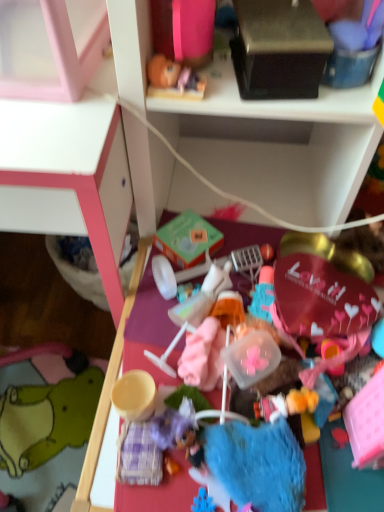
The image size is (384, 512). What do you see at coordinates (48, 416) in the screenshot? I see `green felt plush at lower left` at bounding box center [48, 416].

What do you see at coordinates (279, 49) in the screenshot?
I see `black matte box at upper center` at bounding box center [279, 49].

Where is `plastic toy at center`? The height and width of the screenshot is (512, 384). plastic toy at center is located at coordinates (128, 358).

From the image's perspective, is green felt plush at lower left located above or below black matte box at upper center?

Clearly, from the image's perspective, green felt plush at lower left is below black matte box at upper center.

Which of these two, green felt plush at lower left or black matte box at upper center, is bigger?

Bigger between the two is green felt plush at lower left.

Is green felt plush at lower left not close to black matte box at upper center?

No, green felt plush at lower left is not far away from black matte box at upper center.

I want to click on box that is on the right side of green felt plush at lower left, so click(279, 49).

Is white plastic shelf at upper center not within green felt plush at lower left?

Yes.

Based on the photo, is white plastic shelf at upper center taller than green felt plush at lower left?

Indeed, white plastic shelf at upper center has a greater height compared to green felt plush at lower left.

Are white plastic shelf at upper center and green felt plush at lower left located far from each other?

white plastic shelf at upper center is near green felt plush at lower left, not far away.

Based on the photo, from a real-world perspective, is white plastic shelf at upper center beneath green felt plush at lower left?

No, from a real-world perspective, white plastic shelf at upper center is not beneath green felt plush at lower left.

Does plastic toy at center have a larger size compared to white plastic shelf at upper center?

Actually, plastic toy at center might be smaller than white plastic shelf at upper center.

Is plastic toy at center far from white plastic shelf at upper center?

No, plastic toy at center is in close proximity to white plastic shelf at upper center.

Does plastic toy at center have a lesser width compared to white plastic shelf at upper center?

In fact, plastic toy at center might be wider than white plastic shelf at upper center.

Who is more distant, plastic toy at center or white plastic shelf at upper center?

Positioned behind is plastic toy at center.

Are plastic toy at center and black matte box at upper center far apart?

That's not correct — plastic toy at center is a little close to black matte box at upper center.

Do you think plastic toy at center is within black matte box at upper center, or outside of it?

plastic toy at center is not inside black matte box at upper center, it's outside.

Considering the positions of objects plastic toy at center and black matte box at upper center in the image provided, who is more to the left, plastic toy at center or black matte box at upper center?

plastic toy at center is more to the left.

Which point is more forward, (223, 252) or (301, 51)?

Positioned in front is point (301, 51).

Is plastic toy at center situated inside green felt plush at lower left or outside?

plastic toy at center is outside green felt plush at lower left.

Is plastic toy at center facing towards green felt plush at lower left?

No, plastic toy at center is not aimed at green felt plush at lower left.

From a real-world perspective, is plastic toy at center positioned above or below green felt plush at lower left?

plastic toy at center is situated higher than green felt plush at lower left in the real world.

Is plastic toy at center not near green felt plush at lower left?

plastic toy at center is near green felt plush at lower left, not far away.

From the image's perspective, is white plastic shelf at upper center under black matte box at upper center?

Yes, from the image's perspective, white plastic shelf at upper center is below black matte box at upper center.

Is white plastic shelf at upper center with black matte box at upper center?

They are not placed beside each other.

From a real-world perspective, which is physically below, white plastic shelf at upper center or black matte box at upper center?

white plastic shelf at upper center.

Is white plastic shelf at upper center in front of black matte box at upper center?

Yes, white plastic shelf at upper center is closer to the camera.

Is plastic toy at center surrounded by black matte box at upper center?

No, plastic toy at center is not surrounded by black matte box at upper center.

Considering the sizes of objects black matte box at upper center and plastic toy at center in the image provided, who is bigger, black matte box at upper center or plastic toy at center?

With larger size is plastic toy at center.

Is black matte box at upper center in front of or behind plastic toy at center in the image?

black matte box at upper center is positioned farther from the viewer than plastic toy at center.

How much distance is there between black matte box at upper center and plastic toy at center?

black matte box at upper center is 14.85 inches away from plastic toy at center.

You are a GUI agent. You are given a task and a screenshot of the screen. Output one action in this format:
    pyautogui.click(x=<x>, y=<y>)
    Task: Click on the box above the green felt plush at lower left (from a real-world perspective)
    Image resolution: width=384 pixels, height=512 pixels.
    Given the screenshot: What is the action you would take?
    pyautogui.click(x=279, y=49)

The width and height of the screenshot is (384, 512). In the image, there is a green felt plush at lower left. In order to click on shelf above it (from the image's perspective) in this screenshot , I will do `click(256, 131)`.

Looking at this image, considering their positions, is plastic toy at center positioned further to black matte box at upper center than white plastic shelf at upper center?

Based on the image, plastic toy at center appears to be further to black matte box at upper center.

Consider the image. Based on their spatial positions, is black matte box at upper center or green felt plush at lower left further from plastic toy at center?

The object further to plastic toy at center is green felt plush at lower left.

Looking at the image, which one is located further to black matte box at upper center, white plastic shelf at upper center or green felt plush at lower left?

green felt plush at lower left is positioned further to the anchor black matte box at upper center.

Which object lies further to the anchor point plastic toy at center, green felt plush at lower left or black matte box at upper center?

Based on the image, green felt plush at lower left appears to be further to plastic toy at center.

Looking at this image, estimate the real-world distances between objects in this image. Which object is closer to plastic toy at center, black matte box at upper center or white plastic shelf at upper center?

Among the two, white plastic shelf at upper center is located nearer to plastic toy at center.

Which object lies nearer to the anchor point white plastic shelf at upper center, black matte box at upper center or green felt plush at lower left?

Among the two, black matte box at upper center is located nearer to white plastic shelf at upper center.

Estimate the real-world distances between objects in this image. Which object is further from plastic toy at center, green felt plush at lower left or white plastic shelf at upper center?

green felt plush at lower left.

From the image, which object appears to be nearer to black matte box at upper center, white plastic shelf at upper center or plastic toy at center?

Among the two, white plastic shelf at upper center is located nearer to black matte box at upper center.

The width and height of the screenshot is (384, 512). I want to click on box between green felt plush at lower left and white plastic shelf at upper center in the horizontal direction, so click(x=279, y=49).

Identify the location of shelf between black matte box at upper center and plastic toy at center in the vertical direction. This screenshot has height=512, width=384. (256, 131).

The image size is (384, 512). What are the coordinates of `table between green felt plush at lower left and white plastic shelf at upper center` in the screenshot? It's located at (128, 358).

At what (x,y) coordinates should I click in order to perform the action: click on table situated between green felt plush at lower left and black matte box at upper center from left to right. Please return your answer as a coordinate pair (x, y). The height and width of the screenshot is (512, 384). Looking at the image, I should click on (128, 358).